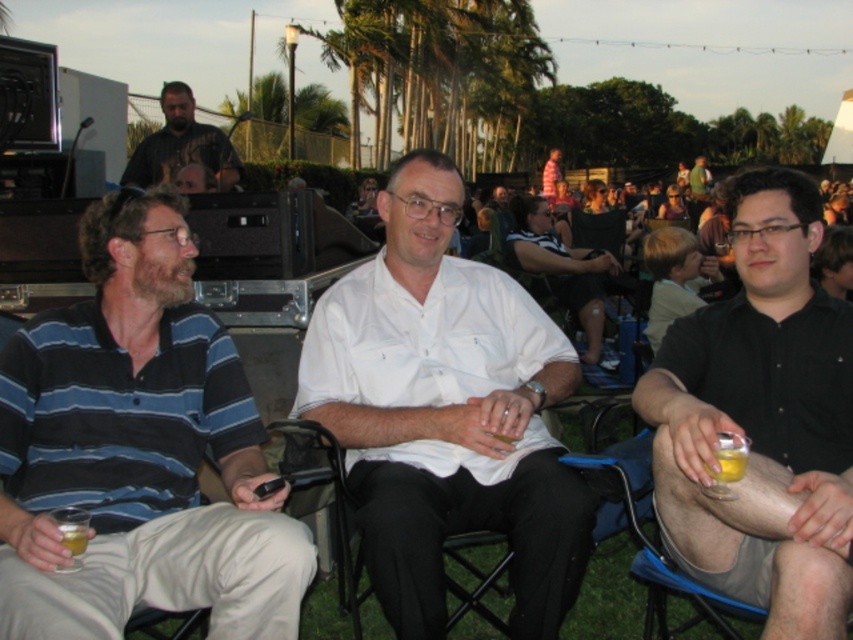
Does point (42, 500) lie behind point (722, 444)?

Yes, point (42, 500) is behind point (722, 444).

Is blue striped polo shirt at left in front of translucent yellow liquid at lower right?

Yes.

Image resolution: width=853 pixels, height=640 pixels. I want to click on blue striped polo shirt at left, so click(x=138, y=449).

Where is `blue striped polo shirt at left`? blue striped polo shirt at left is located at coordinates (138, 449).

Does black shirt at right lie behind translucent glass at lower left?

No, black shirt at right is in front of translucent glass at lower left.

How far apart are black shirt at right and translucent glass at lower left?

They are 5.06 feet apart.

Between point (759, 276) and point (70, 538), which one is positioned behind?

The point (759, 276) is more distant.

Identify the location of black shirt at right. The height and width of the screenshot is (640, 853). (761, 419).

Is point (727, 468) less distant than point (57, 520)?

Yes, point (727, 468) is in front of point (57, 520).

Can you confirm if translucent yellow liquid at lower right is positioned above translucent glass at lower left?

Correct, translucent yellow liquid at lower right is located above translucent glass at lower left.

Locate an element on the screen. Image resolution: width=853 pixels, height=640 pixels. translucent yellow liquid at lower right is located at coordinates (730, 458).

Where is `translucent yellow liquid at lower right`? The image size is (853, 640). translucent yellow liquid at lower right is located at coordinates (730, 458).